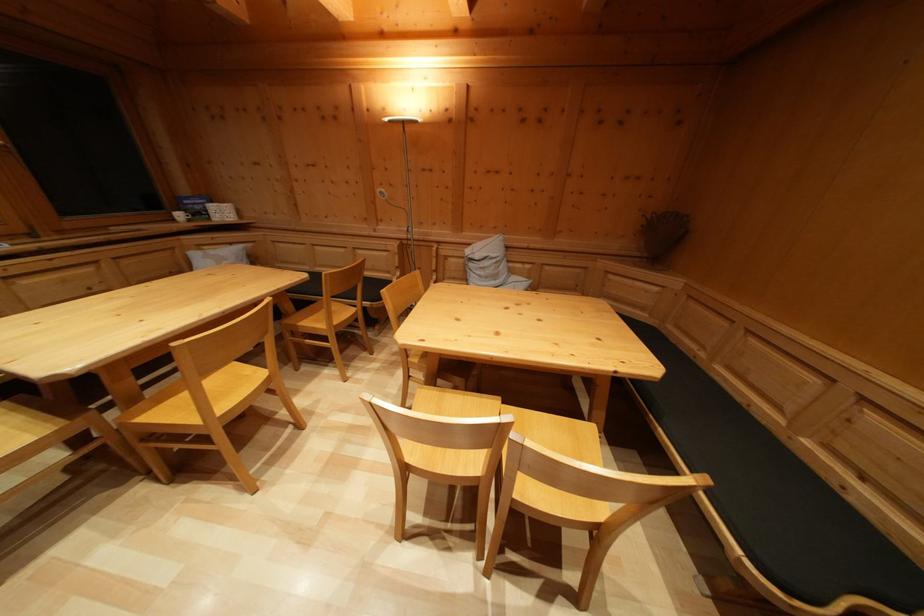
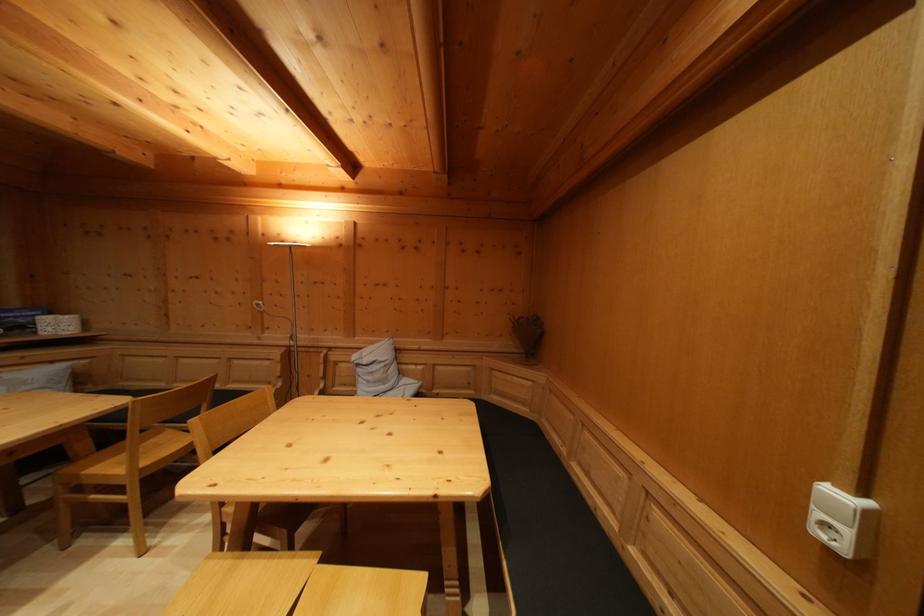
Question: The images are taken continuously from a first-person perspective. In which direction is your viewpoint rotating?

Choices:
 (A) Left
 (B) Right
 (C) Up
 (D) Down

Answer: (C)